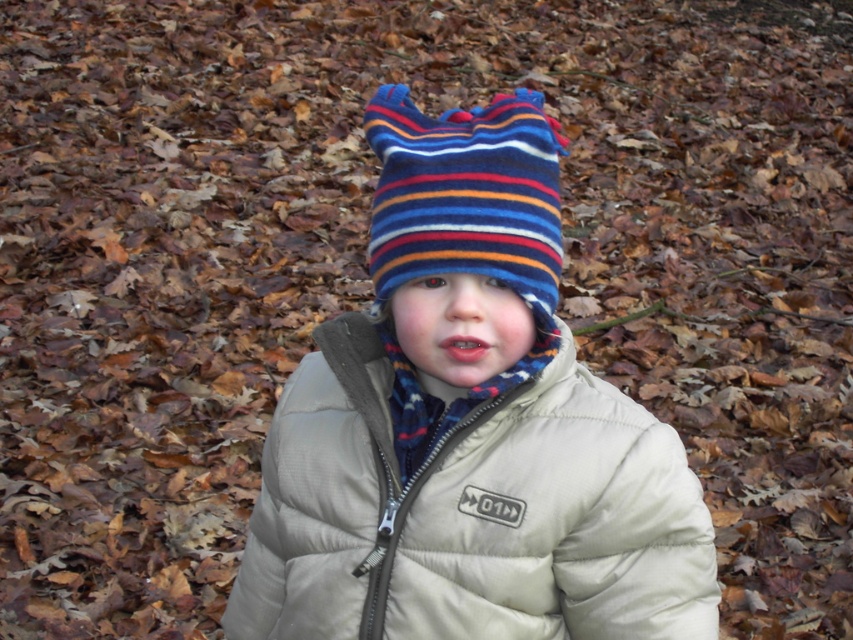
Who is higher up, beige quilted jacket at center or striped woolen hat at center?

striped woolen hat at center is above.

Does beige quilted jacket at center lie behind striped woolen hat at center?

That is True.

Where is `beige quilted jacket at center`? The width and height of the screenshot is (853, 640). beige quilted jacket at center is located at coordinates (471, 513).